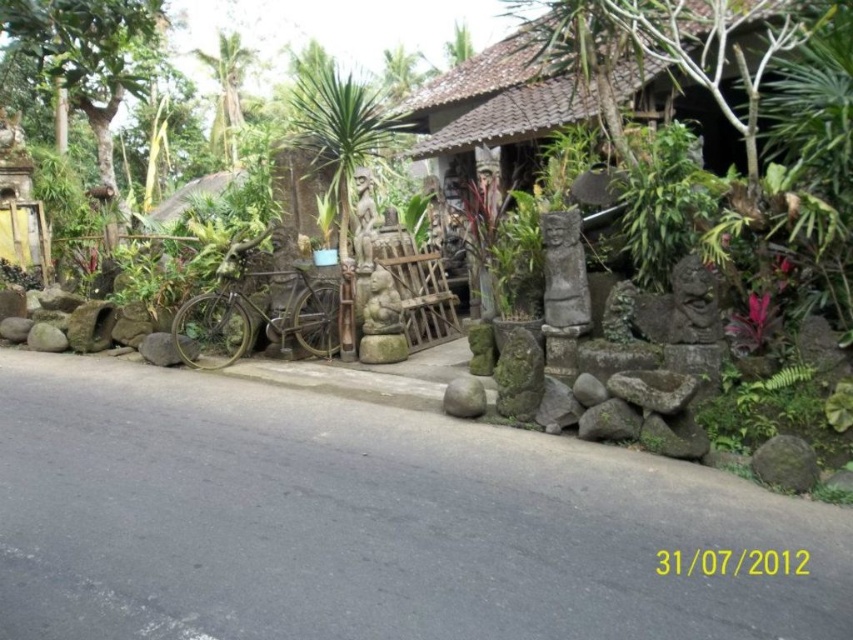
Question: Estimate the real-world distances between objects in this image. Which object is farther from the green stone at center?

Choices:
 (A) rustic stone at center
 (B) rusty metal bicycle at center
 (C) brown textured hut at center

Answer: (C)

Question: Which point appears closest to the camera in this image?

Choices:
 (A) (467, 416)
 (B) (154, 356)

Answer: (A)

Question: Based on their relative distances, which object is nearer to the brown textured hut at center?

Choices:
 (A) green stone at center
 (B) rustic stone at center

Answer: (A)

Question: In this image, where is rustic stone at center located relative to green stone at center?

Choices:
 (A) right
 (B) left

Answer: (B)

Question: Does brown textured hut at center have a larger size compared to green stone at center?

Choices:
 (A) yes
 (B) no

Answer: (A)

Question: Can you confirm if rusty metal bicycle at center is positioned to the right of green stone at center?

Choices:
 (A) no
 (B) yes

Answer: (A)